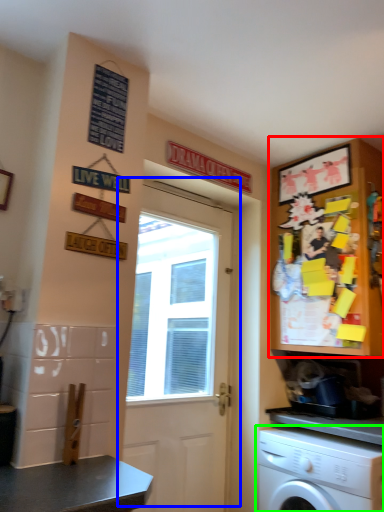
Question: Which object is positioned farthest from cabinetry (highlighted by a red box)? Select from door (highlighted by a blue box) and washing machine (highlighted by a green box).

Choices:
 (A) door
 (B) washing machine

Answer: (A)